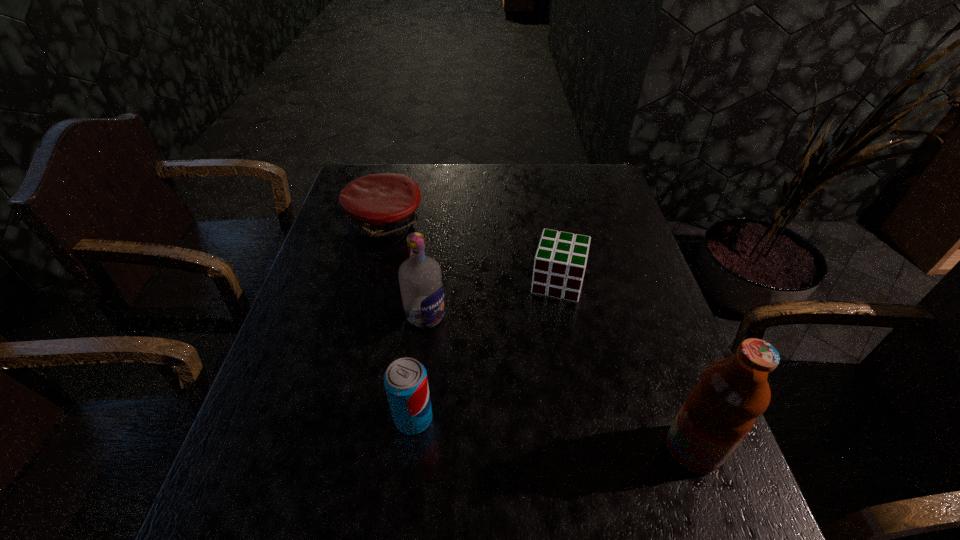
Where is `vacant space in between the third shortest object and the farthest object`? This screenshot has width=960, height=540. vacant space in between the third shortest object and the farthest object is located at coordinates (399, 321).

Where is `free space between the cube and the cap`? The height and width of the screenshot is (540, 960). free space between the cube and the cap is located at coordinates (471, 253).

The height and width of the screenshot is (540, 960). In order to click on blank region between the fourth shortest object and the second object from right to left in this screenshot , I will do `click(492, 299)`.

At what (x,y) coordinates should I click in order to perform the action: click on blank region between the farthest object and the fruit juice. Please return your answer as a coordinate pair (x, y). The width and height of the screenshot is (960, 540). Looking at the image, I should click on (539, 336).

The height and width of the screenshot is (540, 960). What are the coordinates of `free area in between the cube and the second tallest object` in the screenshot? It's located at (492, 299).

Find the location of a particular element. empty location between the second tallest object and the fruit juice is located at coordinates (559, 382).

Locate an element on the screen. The width and height of the screenshot is (960, 540). vacant region between the third shortest object and the tallest object is located at coordinates (553, 434).

At what (x,y) coordinates should I click in order to perform the action: click on vacant area between the soda can and the rightmost object. Please return your answer as a coordinate pair (x, y). Looking at the image, I should click on (553, 434).

Identify which object is the second closest to the cube. Please provide its 2D coordinates. Your answer should be formatted as a tuple, i.e. [(x, y)], where the tuple contains the x and y coordinates of a point satisfying the conditions above.

[(380, 207)]

Select which object is the second closest to the vodka. Please provide its 2D coordinates. Your answer should be formatted as a tuple, i.e. [(x, y)], where the tuple contains the x and y coordinates of a point satisfying the conditions above.

[(380, 207)]